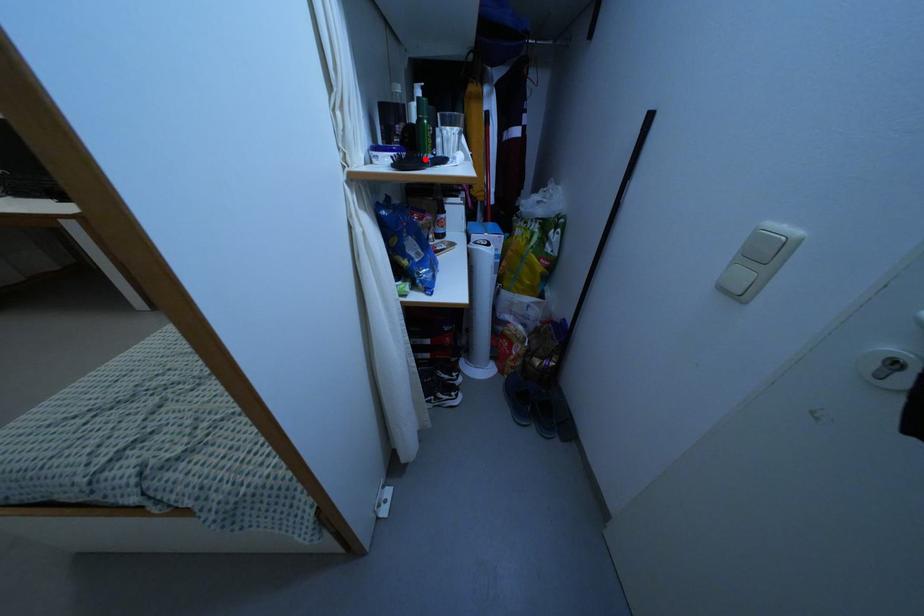
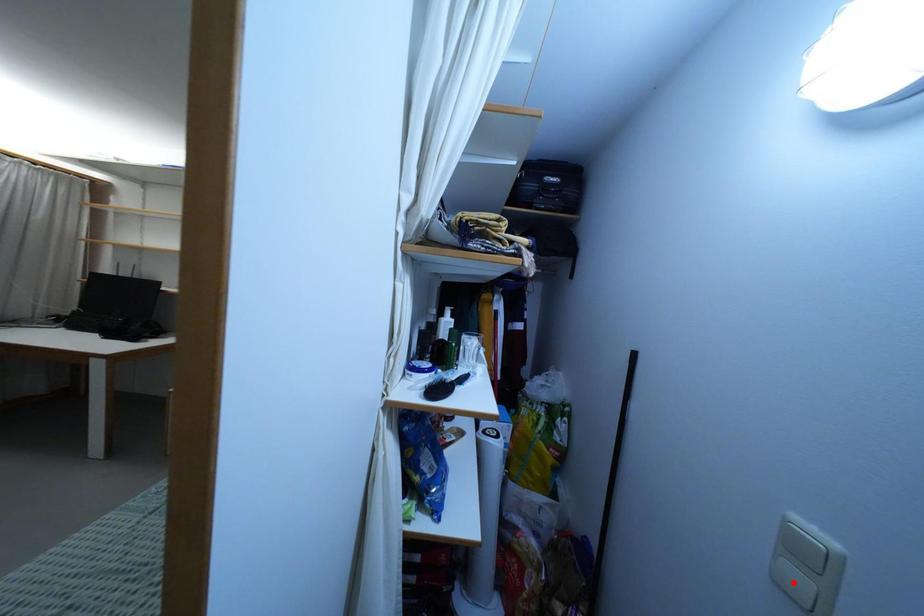
I am providing you with two images of the same scene from different viewpoints. A red point is marked on the first image and another point is marked on the second image. Is the red point in image1 aligned with the point shown in image2?

No